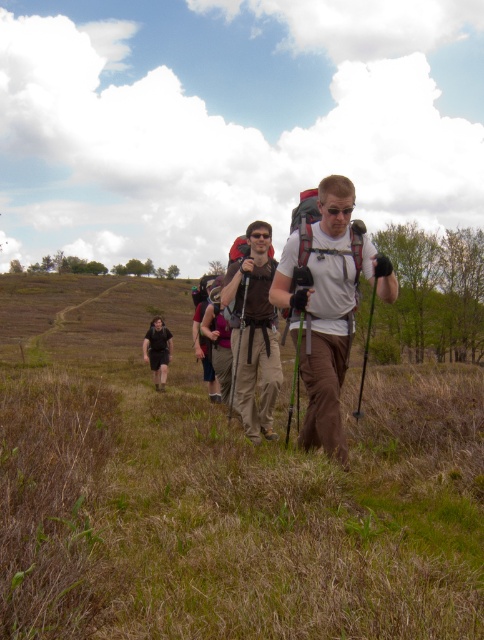
You are a hiker looking at the image and want to know which item is taller between the white matte backpack at center and the black fabric pants at center. Can you tell me?

The white matte backpack at center is taller than the black fabric pants at center.

From the picture: You are a photographer aiming to capture the hikers in the scene. You want to ensure that both the white matte backpack at center and the black fabric pants at center are clearly visible in your shot. Based on their positions, which object should you focus on first to ensure both are in frame?

The white matte backpack at center is positioned on the right side of black fabric pants at center. To ensure both are in frame, focus on the black fabric pants at center first since it is on the left, allowing the backpack to naturally fall into the right side of the frame.